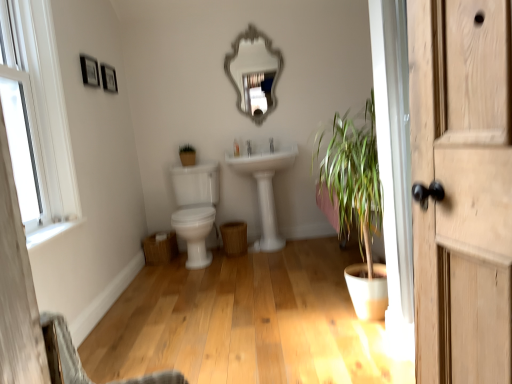
Question: Is white glossy faucet at center positioned beyond the bounds of matte black picture frame at upper left, which appears as the first picture frame when viewed from the back?

Choices:
 (A) no
 (B) yes

Answer: (B)

Question: Considering the relative positions of white glossy faucet at center and matte black picture frame at upper left, which is the 2th picture frame in front-to-back order, in the image provided, is white glossy faucet at center to the right of matte black picture frame at upper left, which is the 2th picture frame in front-to-back order, from the viewer's perspective?

Choices:
 (A) yes
 (B) no

Answer: (A)

Question: Is the depth of white glossy faucet at center less than that of matte black picture frame at upper left, which is the 2th picture frame in front-to-back order?

Choices:
 (A) yes
 (B) no

Answer: (B)

Question: From a real-world perspective, does white glossy faucet at center sit lower than matte black picture frame at upper left, which is the 2th picture frame in front-to-back order?

Choices:
 (A) yes
 (B) no

Answer: (A)

Question: Is white glossy faucet at center thinner than matte black picture frame at upper left, which is the 2th picture frame in front-to-back order?

Choices:
 (A) yes
 (B) no

Answer: (B)

Question: Is the position of white glossy faucet at center more distant than that of matte black picture frame at upper left, which appears as the first picture frame when viewed from the back?

Choices:
 (A) no
 (B) yes

Answer: (B)

Question: Is matte black picture frame at upper left, which is the 2th picture frame in front-to-back order, positioned with its back to white glossy faucet at center?

Choices:
 (A) no
 (B) yes

Answer: (A)

Question: Is matte black picture frame at upper left, which is the 2th picture frame in front-to-back order, thinner than white glossy faucet at center?

Choices:
 (A) yes
 (B) no

Answer: (A)

Question: Is matte black picture frame at upper left, which appears as the first picture frame when viewed from the back, directly adjacent to white glossy faucet at center?

Choices:
 (A) no
 (B) yes

Answer: (A)

Question: Is the position of matte black picture frame at upper left, which appears as the first picture frame when viewed from the back, more distant than that of white glossy faucet at center?

Choices:
 (A) no
 (B) yes

Answer: (A)

Question: From a real-world perspective, is matte black picture frame at upper left, which appears as the first picture frame when viewed from the back, positioned under white glossy faucet at center based on gravity?

Choices:
 (A) no
 (B) yes

Answer: (A)

Question: Is matte black picture frame at upper left, which is the 2th picture frame in front-to-back order, positioned beyond the bounds of white glossy faucet at center?

Choices:
 (A) no
 (B) yes

Answer: (B)

Question: Considering the relative sizes of wooden picture frame at upper left, arranged as the 2th picture frame when viewed from the back, and white glossy faucet at center in the image provided, is wooden picture frame at upper left, arranged as the 2th picture frame when viewed from the back, smaller than white glossy faucet at center?

Choices:
 (A) no
 (B) yes

Answer: (A)